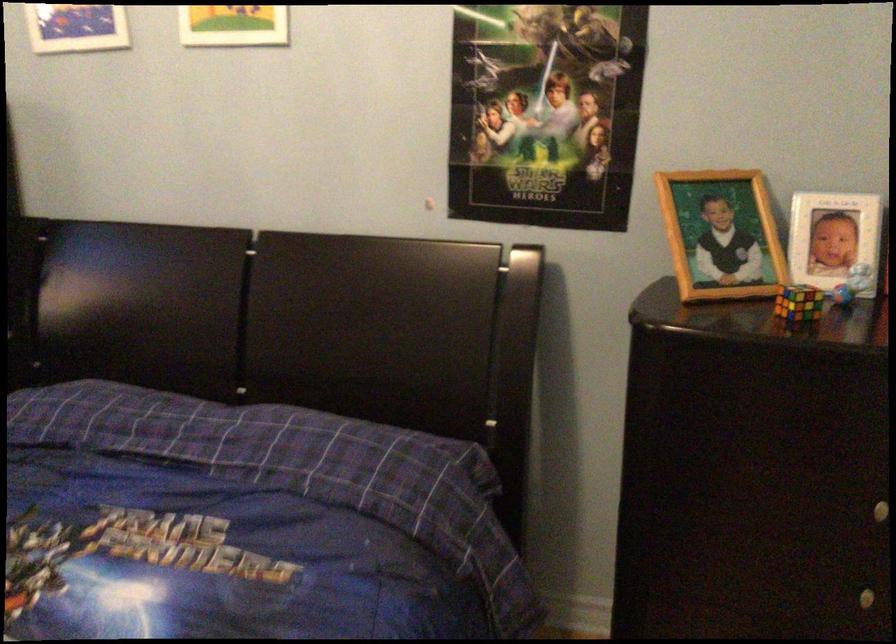
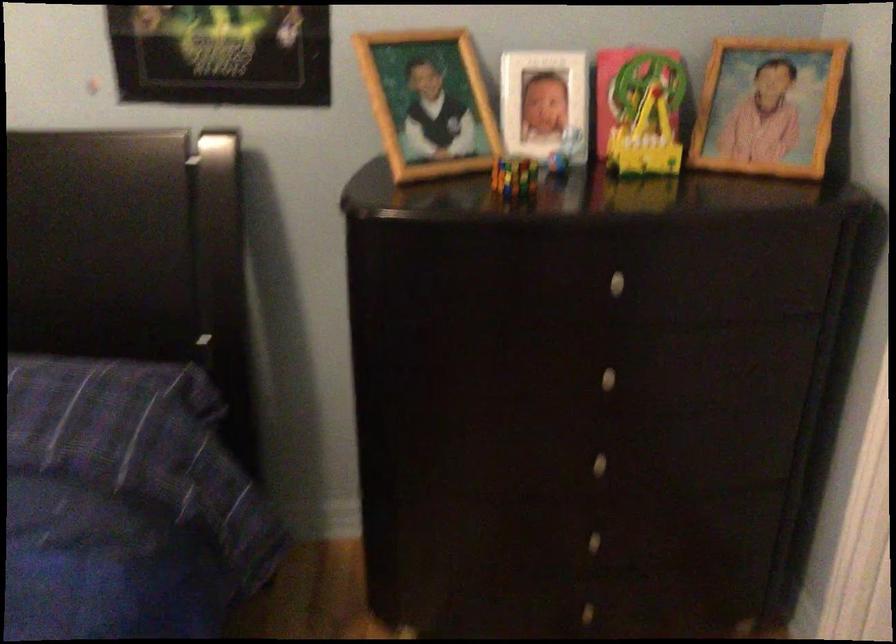
Question: The camera is either moving clockwise (left) or counter-clockwise (right) around the object. The first image is from the beginning of the video and the second image is from the end. Is the camera moving left or right when shooting the video?

Choices:
 (A) Left
 (B) Right

Answer: (A)